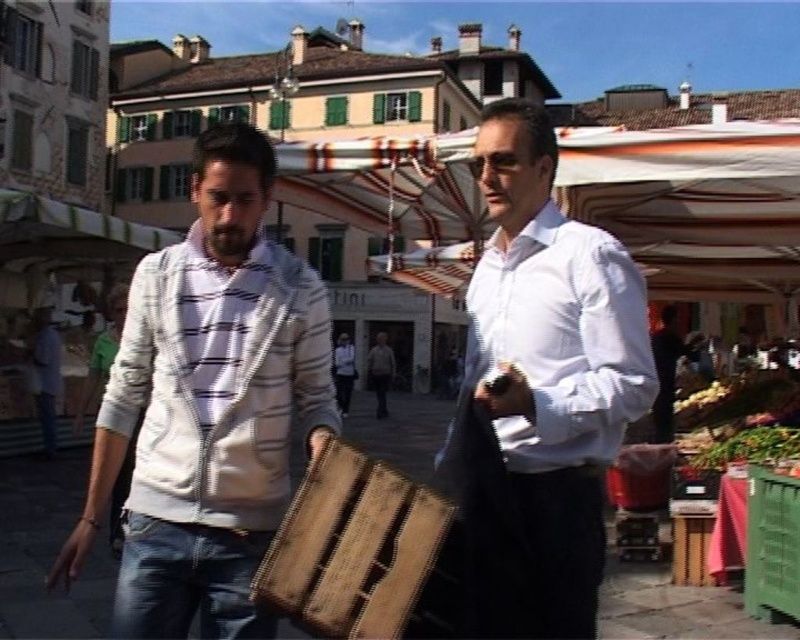
Question: Observing the image, what is the correct spatial positioning of white matte shirt at center in reference to wooden crate at center?

Choices:
 (A) below
 (B) above

Answer: (B)

Question: Is white matte shirt at center positioned in front of white striped awning at center?

Choices:
 (A) no
 (B) yes

Answer: (B)

Question: Which object is closer to the camera taking this photo?

Choices:
 (A) white striped hoodie at center
 (B) wooden crate at center

Answer: (B)

Question: Is wooden crate at center wider than green plastic crate at lower right?

Choices:
 (A) no
 (B) yes

Answer: (B)

Question: Which object is positioned closest to the white matte shirt at center?

Choices:
 (A) white striped awning at center
 (B) wooden crate at center

Answer: (B)

Question: Which point appears closest to the camera in this image?

Choices:
 (A) (168, 634)
 (B) (654, 138)
 (C) (586, 276)

Answer: (A)